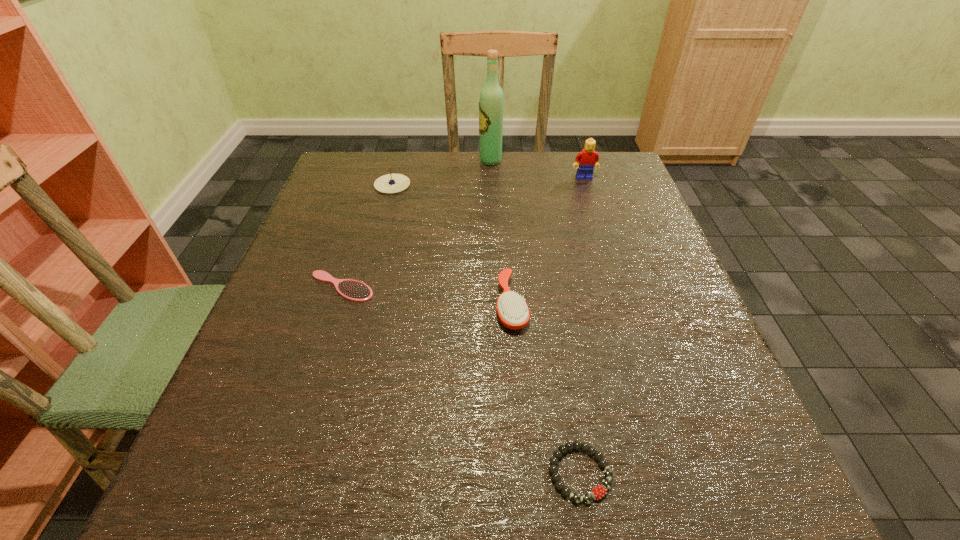
Identify the location of vacant position in the image that satisfies the following two spatial constraints: 1. on the front-facing side of the wine bottle; 2. on the back side of the bracelet. (501, 473).

Where is `free space that satisfies the following two spatial constraints: 1. on the front-facing side of the tallest object; 2. on the left side of the taller hairbrush`? The image size is (960, 540). free space that satisfies the following two spatial constraints: 1. on the front-facing side of the tallest object; 2. on the left side of the taller hairbrush is located at coordinates (495, 305).